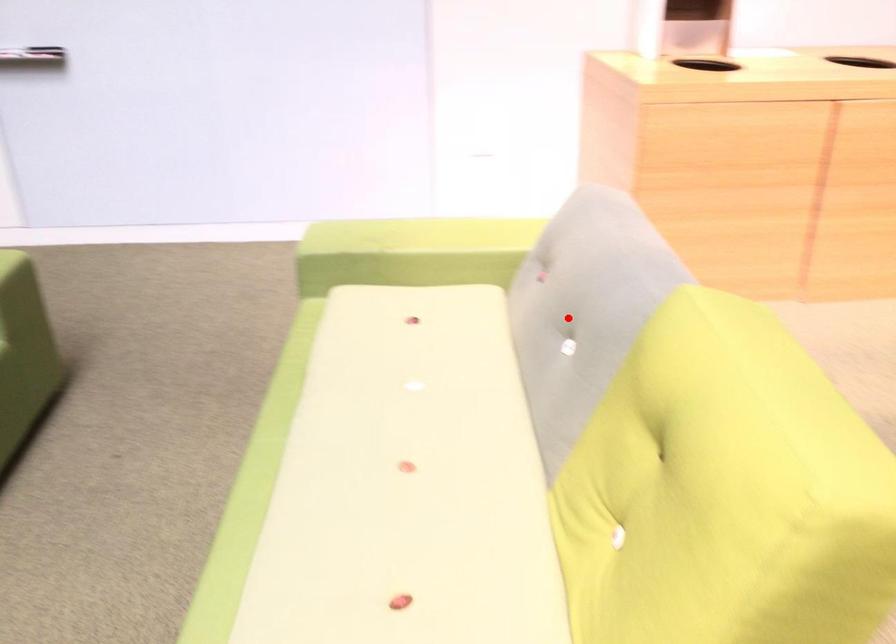
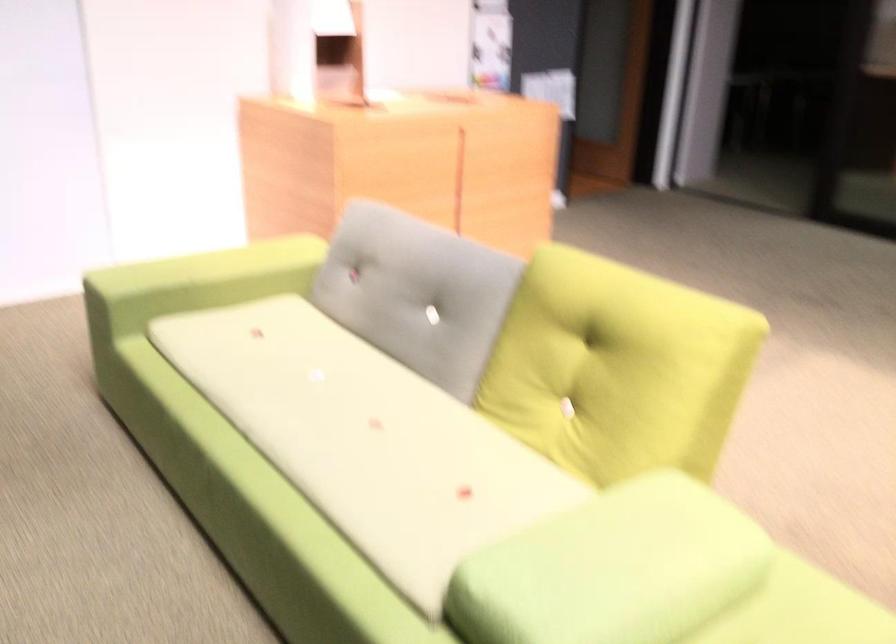
Question: I am providing you with two images of the same scene from different viewpoints. A red point is marked on the first image. Can you still see the location of the red point in image 2?

Choices:
 (A) Yes
 (B) No

Answer: (A)